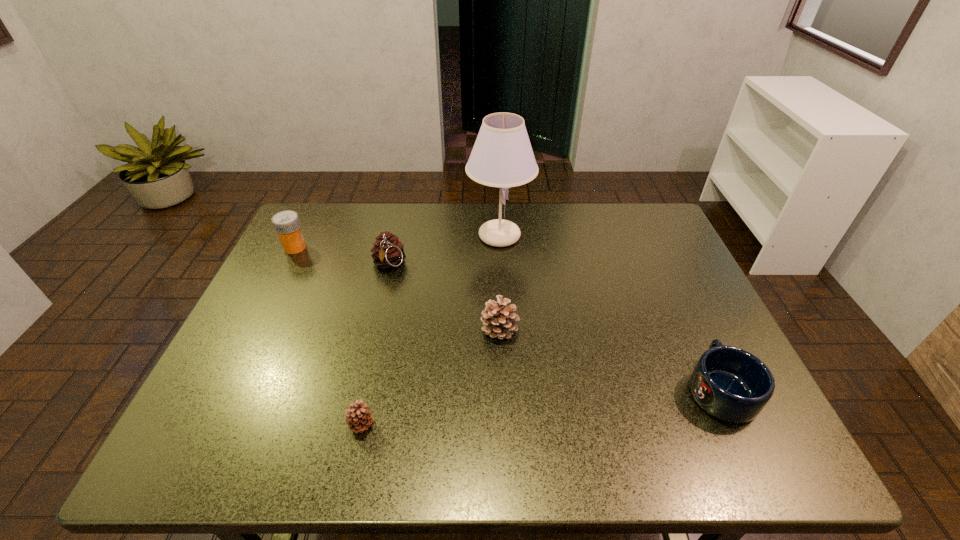
Where is `vacant point located between the farthest pinecone and the medicine`? The image size is (960, 540). vacant point located between the farthest pinecone and the medicine is located at coordinates tap(342, 256).

Image resolution: width=960 pixels, height=540 pixels. Identify the location of free space between the shortest pinecone and the farthest pinecone. (375, 345).

The image size is (960, 540). In order to click on free spot between the nearest pinecone and the rightmost object in this screenshot , I will do `click(540, 407)`.

Find the location of a particular element. The image size is (960, 540). vacant space that is in between the tallest object and the farthest pinecone is located at coordinates (444, 250).

The width and height of the screenshot is (960, 540). I want to click on vacant space that's between the farthest pinecone and the second nearest pinecone, so click(x=444, y=296).

You are a GUI agent. You are given a task and a screenshot of the screen. Output one action in this format:
    pyautogui.click(x=<x>, y=<y>)
    Task: Click on the vacant space in between the lampshade and the nearest pinecone
    This screenshot has height=540, width=960.
    Given the screenshot: What is the action you would take?
    pyautogui.click(x=430, y=330)

Choose which object is the third nearest neighbor to the farthest pinecone. Please provide its 2D coordinates. Your answer should be formatted as a tuple, i.e. [(x, y)], where the tuple contains the x and y coordinates of a point satisfying the conditions above.

[(498, 319)]

Image resolution: width=960 pixels, height=540 pixels. I want to click on object that is the third closest one to the farthest pinecone, so click(498, 319).

Identify which pinecone is the second closest to the mug. Please provide its 2D coordinates. Your answer should be formatted as a tuple, i.e. [(x, y)], where the tuple contains the x and y coordinates of a point satisfying the conditions above.

[(358, 418)]

The height and width of the screenshot is (540, 960). Identify the location of pinecone that can be found as the third closest to the mug. 388,251.